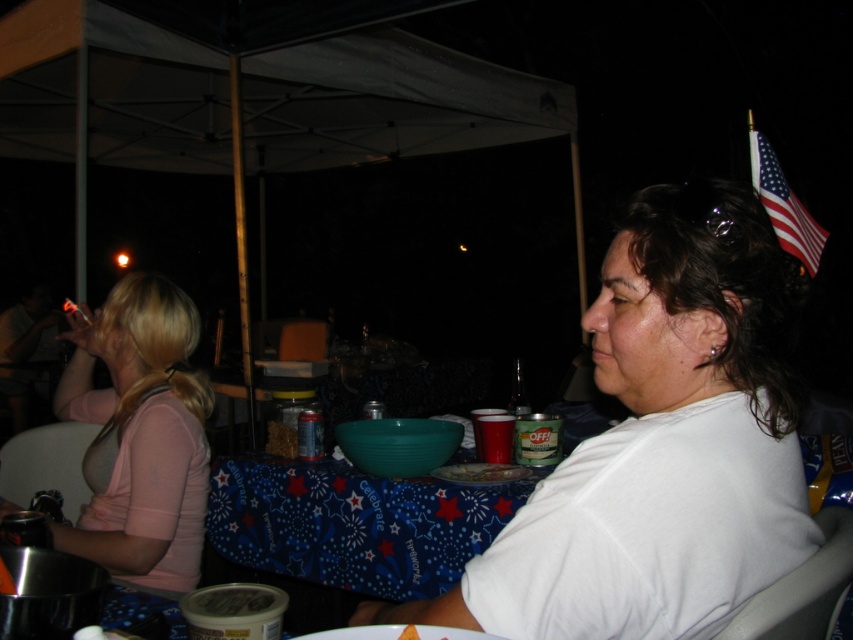
You are at a nighttime gathering under a canopy tent. You see a white matte shirt at center and an american flag at upper right. Which object is positioned to the right of the other?

The american flag at upper right is to the right of the white matte shirt at center.

You are at the nighttime gathering and want to hand a drink to the person wearing the pink fabric shirt at left. The drink is currently on the translucent plastic bowl at center. Can you reach the drink without moving any other items?

The pink fabric shirt at left is closer to the viewer than the translucent plastic bowl at center, so you can reach the drink on the translucent plastic bowl at center without needing to move other items as it is in a reachable position.

You are planning to place a large centerpiece on the blue fabric table at center. Considering the size of the table compared to the american flag at upper right, will the centerpiece fit comfortably without overhanging the edges?

The blue fabric table at center is smaller than the american flag at upper right. Since the table is smaller, placing a large centerpiece might cause it to overhang the edges. Choose a smaller centerpiece instead.